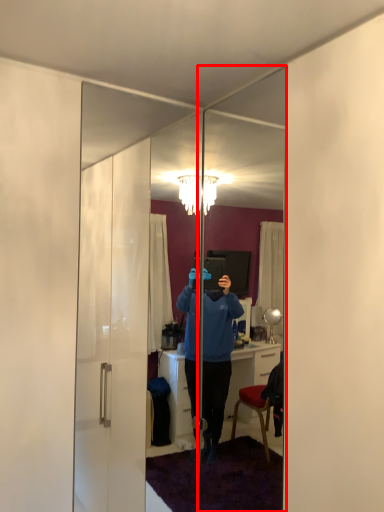
Question: From the image's perspective, where is mirror (annotated by the red box) located in relation to mirror in the image?

Choices:
 (A) above
 (B) below

Answer: (B)